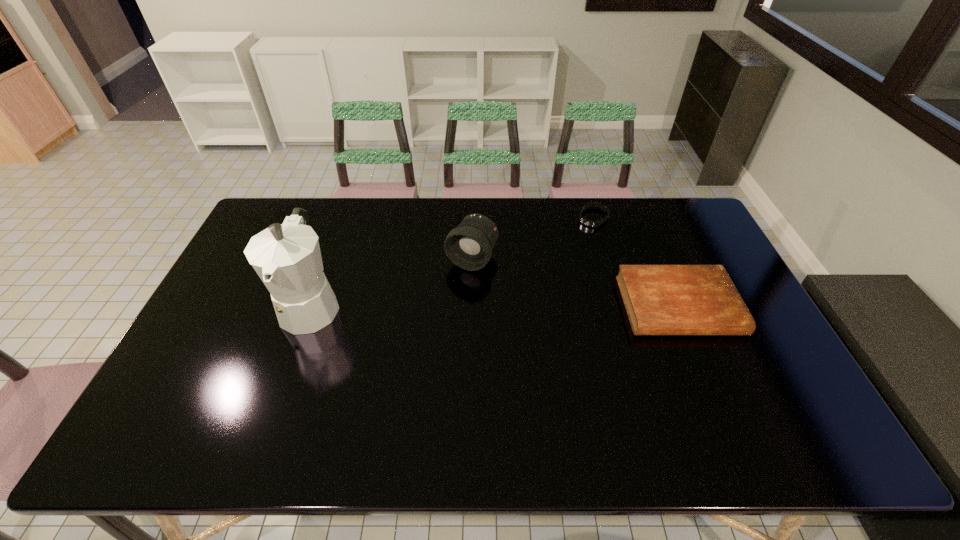
Where is `the leftmost object`? The height and width of the screenshot is (540, 960). the leftmost object is located at coordinates (287, 258).

Find the location of a particular element. The height and width of the screenshot is (540, 960). the tallest object is located at coordinates (287, 258).

You are a GUI agent. You are given a task and a screenshot of the screen. Output one action in this format:
    pyautogui.click(x=<x>, y=<y>)
    Task: Click on the second shortest object
    
    Given the screenshot: What is the action you would take?
    pyautogui.click(x=659, y=299)

You are a GUI agent. You are given a task and a screenshot of the screen. Output one action in this format:
    pyautogui.click(x=<x>, y=<y>)
    Task: Click on the shortest object
    The width and height of the screenshot is (960, 540).
    Given the screenshot: What is the action you would take?
    click(x=585, y=221)

Where is `the farthest object`? The height and width of the screenshot is (540, 960). the farthest object is located at coordinates (585, 221).

Where is `telephoto lens`? This screenshot has height=540, width=960. telephoto lens is located at coordinates (469, 246).

Find the location of `the third object from right to left`. the third object from right to left is located at coordinates (469, 246).

Where is `vacant point located 0.150m at the spout of the coffeepot`? The image size is (960, 540). vacant point located 0.150m at the spout of the coffeepot is located at coordinates (279, 395).

This screenshot has height=540, width=960. Identify the location of vacant area situated on the spine side of the Bible. (712, 386).

Where is `free location located 0.380m on the display of the farthest object`? The width and height of the screenshot is (960, 540). free location located 0.380m on the display of the farthest object is located at coordinates (535, 291).